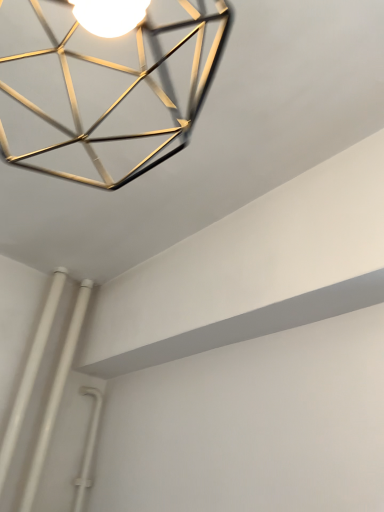
Describe the element at coordinates (55, 396) in the screenshot. The width and height of the screenshot is (384, 512). I see `white plastic pipes at lower left` at that location.

I want to click on white plastic pipes at lower left, so click(55, 396).

At what (x,y) coordinates should I click in order to perform the action: click on gold metallic geometric frame at upper center. Please return your answer as a coordinate pair (x, y). The width and height of the screenshot is (384, 512). Looking at the image, I should click on point(126,91).

Describe the element at coordinates (126, 91) in the screenshot. I see `gold metallic geometric frame at upper center` at that location.

In order to click on white plastic pipes at lower left in this screenshot , I will do `click(55, 396)`.

Is gold metallic geometric frame at upper center to the left of white plastic pipes at lower left from the viewer's perspective?

In fact, gold metallic geometric frame at upper center is to the right of white plastic pipes at lower left.

Is gold metallic geometric frame at upper center positioned behind white plastic pipes at lower left?

That is False.

Which is nearer, (146, 28) or (88, 281)?

Positioned in front is point (146, 28).

From the image's perspective, between gold metallic geometric frame at upper center and white plastic pipes at lower left, who is located below?

white plastic pipes at lower left.

From a real-world perspective, which is physically below, gold metallic geometric frame at upper center or white plastic pipes at lower left?

From a 3D spatial view, white plastic pipes at lower left is below.

Does gold metallic geometric frame at upper center have a greater width compared to white plastic pipes at lower left?

Yes, gold metallic geometric frame at upper center is wider than white plastic pipes at lower left.

Is gold metallic geometric frame at upper center shorter than white plastic pipes at lower left?

Indeed, gold metallic geometric frame at upper center has a lesser height compared to white plastic pipes at lower left.

Does gold metallic geometric frame at upper center have a smaller size compared to white plastic pipes at lower left?

Incorrect, gold metallic geometric frame at upper center is not smaller in size than white plastic pipes at lower left.

Is gold metallic geometric frame at upper center surrounding white plastic pipes at lower left?

No.

Is gold metallic geometric frame at upper center next to white plastic pipes at lower left?

No, gold metallic geometric frame at upper center is not making contact with white plastic pipes at lower left.

Is gold metallic geometric frame at upper center looking in the opposite direction of white plastic pipes at lower left?

No, gold metallic geometric frame at upper center is not facing away from white plastic pipes at lower left.

What's the angular difference between gold metallic geometric frame at upper center and white plastic pipes at lower left's facing directions?

gold metallic geometric frame at upper center and white plastic pipes at lower left are facing 0.393 degrees away from each other.

At what (x,y) coordinates should I click in order to perform the action: click on pipe that appears behind the gold metallic geometric frame at upper center. Please return your answer as a coordinate pair (x, y). The width and height of the screenshot is (384, 512). Looking at the image, I should click on (55, 396).

Is white plastic pipes at lower left at the right side of gold metallic geometric frame at upper center?

No.

In the image, is white plastic pipes at lower left positioned in front of or behind gold metallic geometric frame at upper center?

white plastic pipes at lower left is positioned farther from the viewer than gold metallic geometric frame at upper center.

Does point (56, 404) lie behind point (156, 29)?

Yes, it is.

From the image's perspective, does white plastic pipes at lower left appear lower than gold metallic geometric frame at upper center?

Yes.

From a real-world perspective, relative to gold metallic geometric frame at upper center, is white plastic pipes at lower left vertically above or below?

From a real-world perspective, white plastic pipes at lower left is physically below gold metallic geometric frame at upper center.

Considering the sizes of objects white plastic pipes at lower left and gold metallic geometric frame at upper center in the image provided, who is thinner, white plastic pipes at lower left or gold metallic geometric frame at upper center?

white plastic pipes at lower left is thinner.

Between white plastic pipes at lower left and gold metallic geometric frame at upper center, which one has more height?

white plastic pipes at lower left is taller.

Considering the relative sizes of white plastic pipes at lower left and gold metallic geometric frame at upper center in the image provided, is white plastic pipes at lower left bigger than gold metallic geometric frame at upper center?

No.

Does white plastic pipes at lower left contain gold metallic geometric frame at upper center?

Actually, gold metallic geometric frame at upper center is outside white plastic pipes at lower left.

Is the surface of white plastic pipes at lower left in direct contact with gold metallic geometric frame at upper center?

No, white plastic pipes at lower left is not in contact with gold metallic geometric frame at upper center.

Could you tell me if white plastic pipes at lower left is facing gold metallic geometric frame at upper center?

No.

Can you tell me how much white plastic pipes at lower left and gold metallic geometric frame at upper center differ in facing direction?

0.393 degrees separate the facing orientations of white plastic pipes at lower left and gold metallic geometric frame at upper center.

Image resolution: width=384 pixels, height=512 pixels. In order to click on pipe on the left of gold metallic geometric frame at upper center in this screenshot , I will do `click(55, 396)`.

What are the coordinates of `pipe below the gold metallic geometric frame at upper center (from a real-world perspective)` in the screenshot? It's located at (55, 396).

Find the location of a particular element. pipe that is below the gold metallic geometric frame at upper center (from the image's perspective) is located at coordinates (55, 396).